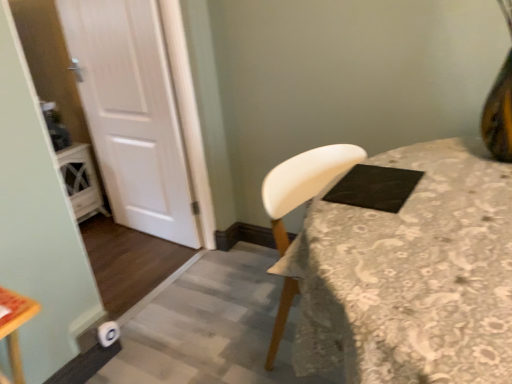
Locate an element on the screen. The height and width of the screenshot is (384, 512). free location in front of black matte pad at upper right is located at coordinates (386, 213).